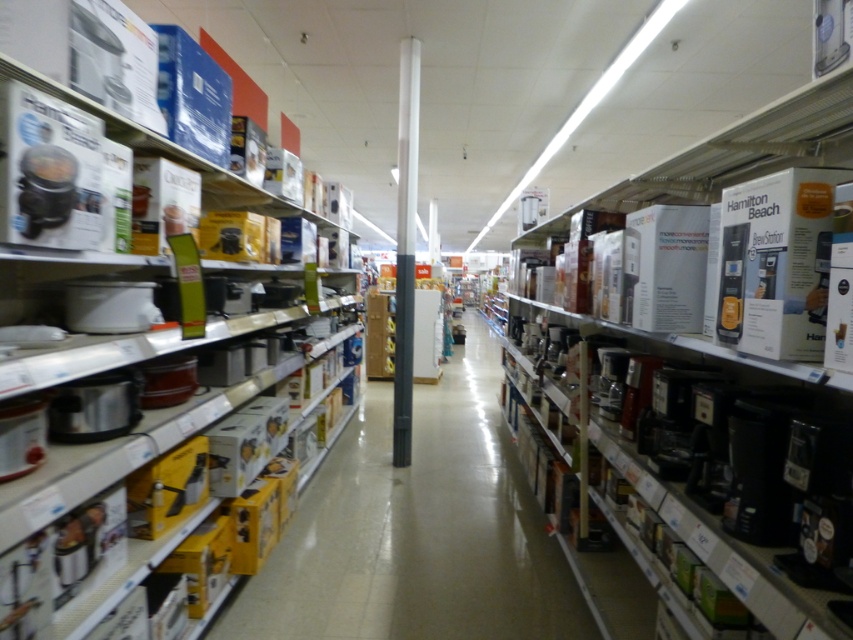
Looking at this image, does matte black coffee maker at center lie in front of matte white crockpot at upper left?

That is False.

Between matte black coffee maker at center and matte white crockpot at upper left, which one appears on the left side from the viewer's perspective?

From the viewer's perspective, matte white crockpot at upper left appears more on the left side.

What do you see at coordinates (418, 529) in the screenshot? I see `matte black coffee maker at center` at bounding box center [418, 529].

This screenshot has width=853, height=640. Identify the location of matte black coffee maker at center. (418, 529).